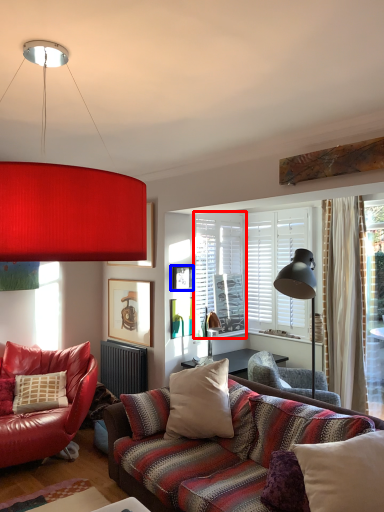
Question: Which object appears closest to the camera in this image, window screen (highlighted by a red box) or picture frame (highlighted by a blue box)?

Choices:
 (A) window screen
 (B) picture frame

Answer: (B)